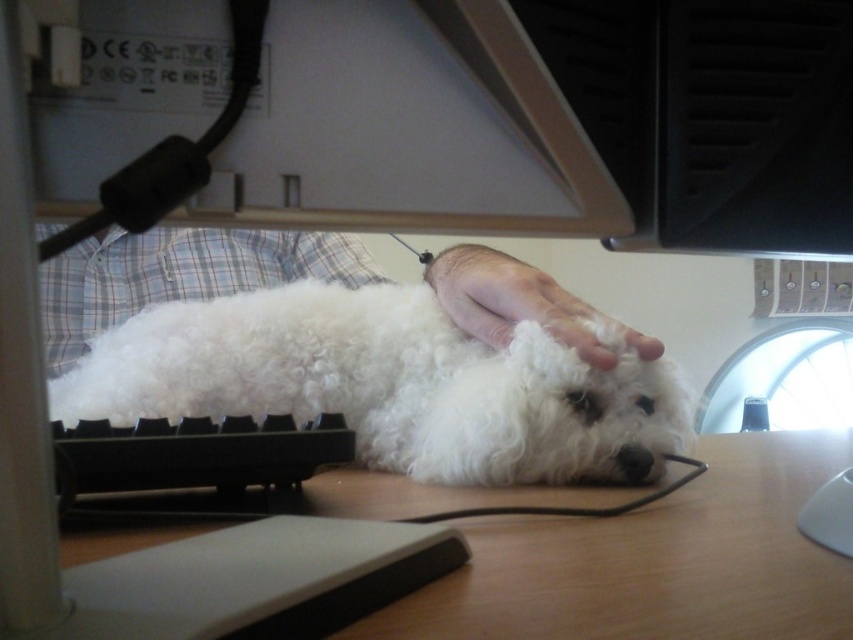
You are trying to place a small toy between the white curly fur dog at center and the wooden at center on the desk. Based on their positions, where should you place the toy?

The white curly fur dog at center is to the left of the wooden at center, so you should place the toy between them to the right of the dog and left of the wooden object.

You are a robotic petting assistant. You need to ensure that your robotic hand can safely pet the dog without causing discomfort. Based on the scene, can you confirm that the white soft hand at center is positioned above the white curly fur dog at center?

Yes, the white soft hand at center is positioned above the white curly fur dog at center, allowing safe and comfortable petting.